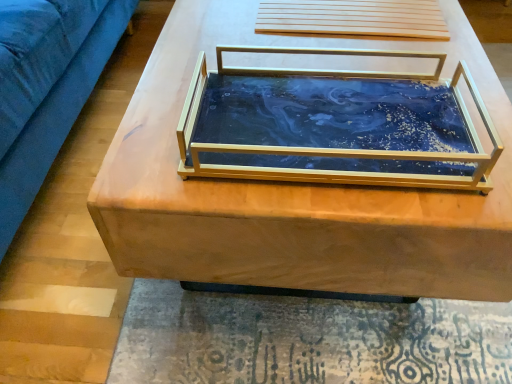
Question: Should I look upward or downward to see marble-like blue tray at center?

Choices:
 (A) down
 (B) up

Answer: (B)

Question: Are marble-like blue tray at center and wooden table at center located far from each other?

Choices:
 (A) yes
 (B) no

Answer: (B)

Question: Is marble-like blue tray at center to the right of wooden table at center from the viewer's perspective?

Choices:
 (A) yes
 (B) no

Answer: (B)

Question: Considering the relative positions of marble-like blue tray at center and wooden table at center in the image provided, is marble-like blue tray at center in front of wooden table at center?

Choices:
 (A) yes
 (B) no

Answer: (A)

Question: Is marble-like blue tray at center oriented away from wooden table at center?

Choices:
 (A) yes
 (B) no

Answer: (B)

Question: Considering the relative sizes of marble-like blue tray at center and wooden table at center in the image provided, is marble-like blue tray at center smaller than wooden table at center?

Choices:
 (A) yes
 (B) no

Answer: (A)

Question: Is marble-like blue tray at center behind wooden table at center?

Choices:
 (A) no
 (B) yes

Answer: (A)

Question: From a real-world perspective, is wooden table at center on marble-like blue tray at center?

Choices:
 (A) no
 (B) yes

Answer: (A)

Question: Are wooden table at center and marble-like blue tray at center making contact?

Choices:
 (A) no
 (B) yes

Answer: (B)

Question: Can you confirm if wooden table at center is taller than marble-like blue tray at center?

Choices:
 (A) yes
 (B) no

Answer: (A)

Question: Does wooden table at center come in front of marble-like blue tray at center?

Choices:
 (A) yes
 (B) no

Answer: (B)

Question: Is wooden table at center smaller than marble-like blue tray at center?

Choices:
 (A) no
 (B) yes

Answer: (A)

Question: Does wooden table at center have a lesser height compared to marble-like blue tray at center?

Choices:
 (A) yes
 (B) no

Answer: (B)

Question: From the image's perspective, is marble-like blue tray at center above or below wooden table at center?

Choices:
 (A) above
 (B) below

Answer: (B)